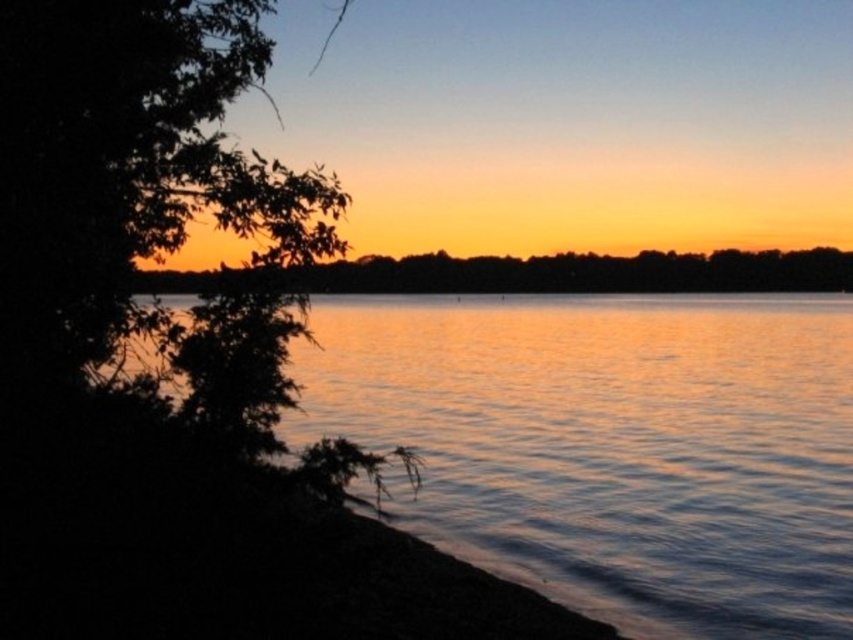
Question: Can you confirm if shiny reflective water at left is positioned to the right of silhouette tree at center?

Choices:
 (A) yes
 (B) no

Answer: (A)

Question: Observing the image, what is the correct spatial positioning of shiny reflective water at left in reference to silhouette tree at center?

Choices:
 (A) left
 (B) right

Answer: (B)

Question: Among these objects, which one is nearest to the camera?

Choices:
 (A) silhouette tree at center
 (B) shiny reflective water at left

Answer: (A)

Question: Does shiny reflective water at left come behind silhouette tree at center?

Choices:
 (A) no
 (B) yes

Answer: (B)